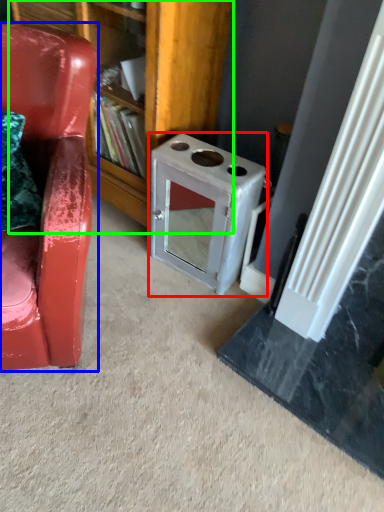
Question: Which object is the farthest from appliance (highlighted by a red box)? Choose among these: chair (highlighted by a blue box) or bookshelf (highlighted by a green box).

Choices:
 (A) chair
 (B) bookshelf

Answer: (A)